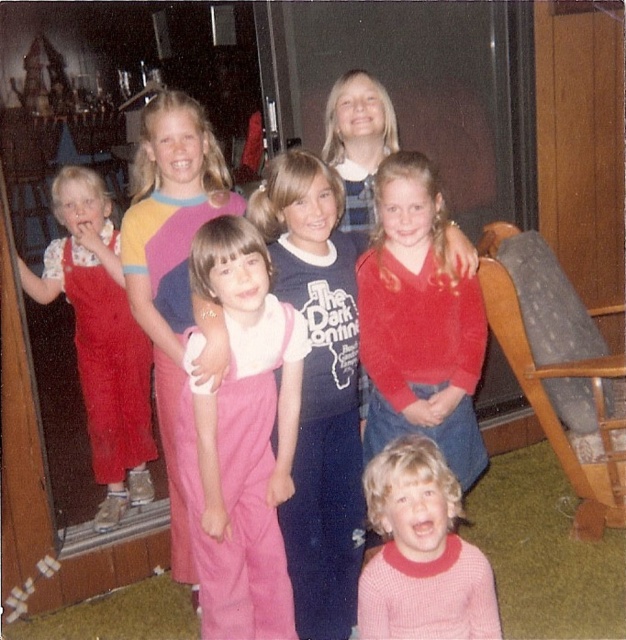
Question: Is pink corduroy overalls at center to the left of matte red sweater at center from the viewer's perspective?

Choices:
 (A) no
 (B) yes

Answer: (B)

Question: Which of the following is the farthest from the observer?

Choices:
 (A) pink knitted sweater at lower center
 (B) pink fabric pants at center

Answer: (A)

Question: Does matte red sweater at center appear on the left side of pink fabric pants at center?

Choices:
 (A) no
 (B) yes

Answer: (A)

Question: Considering the real-world distances, which object is farthest from the gray fabric rocking chair at lower right?

Choices:
 (A) pink fabric pants at center
 (B) pink knitted sweater at lower center

Answer: (A)

Question: Which point is farther from the camera taking this photo?

Choices:
 (A) (175, 353)
 (B) (85, 237)
 (C) (418, 486)
 (D) (448, 296)

Answer: (B)

Question: Is pink corduroy overalls at center smaller than matte red sweater at center?

Choices:
 (A) yes
 (B) no

Answer: (A)